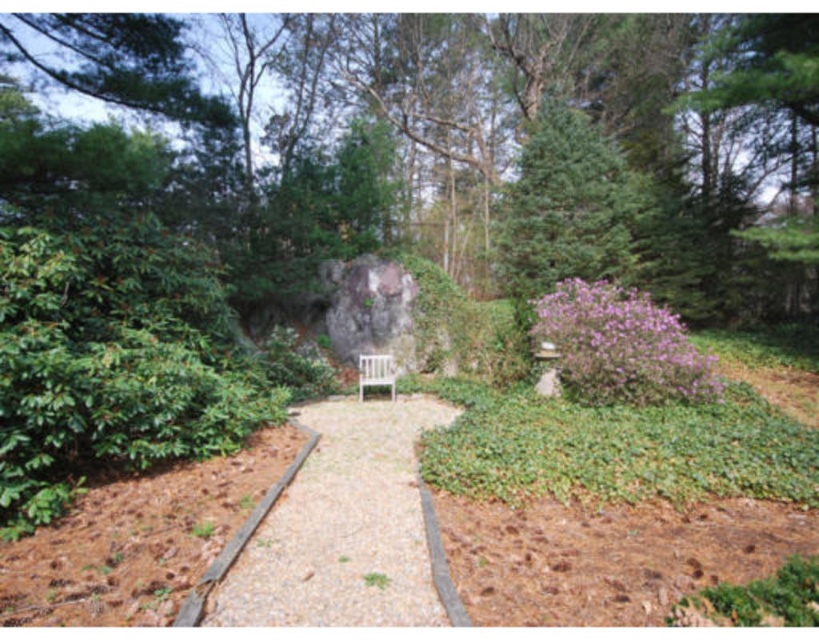
You are standing at the point marked by the coordinates (444,144) in the garden scene. Based on the image description, what object or feature is located exactly at that point?

The point at coordinates (444,144) marks the location of the green leafy tree at center.

You are a gardener planning to place a new decorative statue on the gravel pathway. The statue requires a clear space of 2 meters in front of it. If you place the statue at the base of the green leafy tree at center, will there be enough space between the statue and the white wooden bench at center?

The green leafy tree at center is in front of the white wooden bench at center, so placing the statue at the base of the green leafy tree at center would mean the bench is behind the tree. The distance between the statue and the bench isn